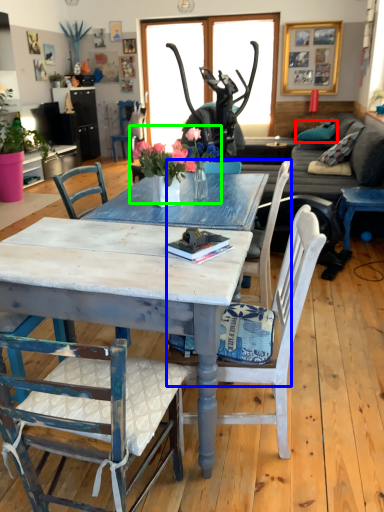
Question: Which object is positioned closest to pillow (highlighted by a red box)? Select from chair (highlighted by a blue box) and floral arrangement (highlighted by a green box).

Choices:
 (A) chair
 (B) floral arrangement

Answer: (A)